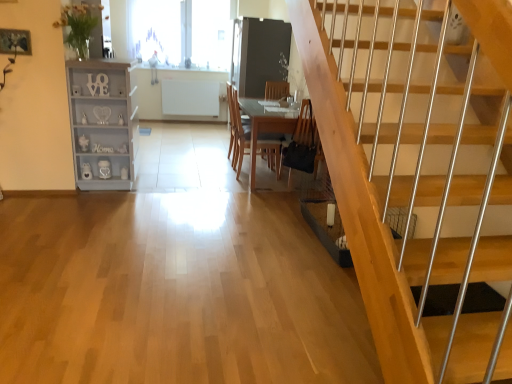
Question: In terms of width, does black leather chair at lower center look wider or thinner when compared to transparent glass window at upper center, which ranks as the second window in back-to-front order?

Choices:
 (A) wide
 (B) thin

Answer: (A)

Question: Relative to transparent glass window at upper center, which ranks as the second window in back-to-front order, is black leather chair at lower center in front or behind?

Choices:
 (A) behind
 (B) front

Answer: (B)

Question: Which of these objects is positioned closest to the transparent glass window at upper center, which ranks as the second window in back-to-front order?

Choices:
 (A) white painted wood shelf at left
 (B) wooden table at center
 (C) transparent glass window at upper center, positioned as the first window in back-to-front order
 (D) black leather chair at lower center
 (E) matte black glass door at center

Answer: (C)

Question: Which object is the farthest from the transparent glass window at upper center, positioned as the first window in back-to-front order?

Choices:
 (A) wooden table at center
 (B) wooden chair at center
 (C) transparent glass window at upper center, which ranks as the second window in back-to-front order
 (D) black leather chair at lower center
 (E) white painted wood shelf at left

Answer: (D)